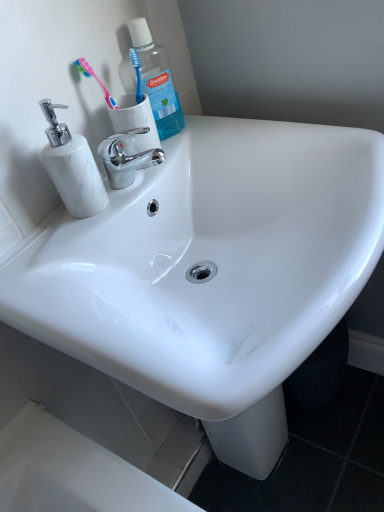
Question: Is blue translucent plastic mouthwash at upper left positioned behind pink plastic toothbrush at upper left?

Choices:
 (A) yes
 (B) no

Answer: (A)

Question: Is blue translucent plastic mouthwash at upper left facing away from pink plastic toothbrush at upper left?

Choices:
 (A) yes
 (B) no

Answer: (B)

Question: Is pink plastic toothbrush at upper left located within blue translucent plastic mouthwash at upper left?

Choices:
 (A) yes
 (B) no

Answer: (B)

Question: From a real-world perspective, is blue translucent plastic mouthwash at upper left located higher than pink plastic toothbrush at upper left?

Choices:
 (A) no
 (B) yes

Answer: (A)

Question: Can you confirm if blue translucent plastic mouthwash at upper left is taller than pink plastic toothbrush at upper left?

Choices:
 (A) yes
 (B) no

Answer: (A)

Question: Considering their positions, is blue translucent plastic mouthwash at upper left located in front of or behind white glossy sink at center?

Choices:
 (A) behind
 (B) front

Answer: (A)

Question: Considering the relative positions of blue translucent plastic mouthwash at upper left and white glossy sink at center in the image provided, is blue translucent plastic mouthwash at upper left to the left or to the right of white glossy sink at center?

Choices:
 (A) right
 (B) left

Answer: (B)

Question: Based on their sizes in the image, would you say blue translucent plastic mouthwash at upper left is bigger or smaller than white glossy sink at center?

Choices:
 (A) small
 (B) big

Answer: (A)

Question: Is point (165, 80) positioned closer to the camera than point (291, 168)?

Choices:
 (A) closer
 (B) farther

Answer: (B)

Question: Considering the positions of point (77, 254) and point (76, 137), is point (77, 254) closer or farther from the camera than point (76, 137)?

Choices:
 (A) farther
 (B) closer

Answer: (B)

Question: Choose the correct answer: Is white glossy sink at center inside white marble soap dispenser at left or outside it?

Choices:
 (A) inside
 (B) outside

Answer: (B)

Question: From the image's perspective, is white glossy sink at center above or below white marble soap dispenser at left?

Choices:
 (A) below
 (B) above

Answer: (A)

Question: From their relative heights in the image, would you say white glossy sink at center is taller or shorter than white marble soap dispenser at left?

Choices:
 (A) tall
 (B) short

Answer: (A)

Question: From a real-world perspective, relative to white marble soap dispenser at left, is pink plastic toothbrush at upper left vertically above or below?

Choices:
 (A) above
 (B) below

Answer: (A)

Question: From their relative heights in the image, would you say pink plastic toothbrush at upper left is taller or shorter than white marble soap dispenser at left?

Choices:
 (A) tall
 (B) short

Answer: (B)